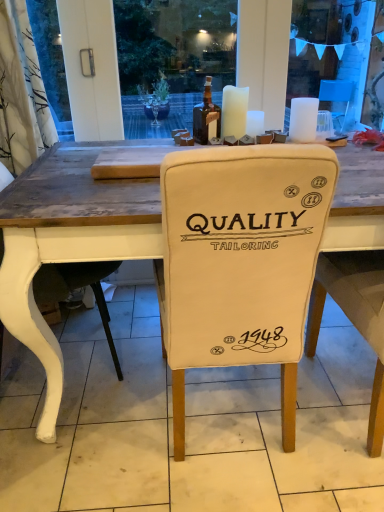
At what (x,y) coordinates should I click in order to perform the action: click on vacant space in white fabric chair at center (from a real-world perspective). Please return your answer as a coordinate pair (x, y). The height and width of the screenshot is (512, 384). Looking at the image, I should click on (225, 415).